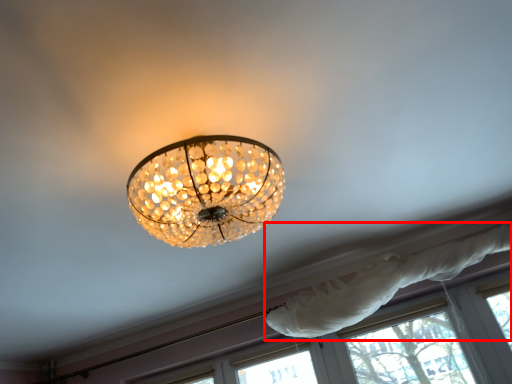
Question: In this image, where is curtain (annotated by the red box) located relative to window?

Choices:
 (A) right
 (B) left

Answer: (A)